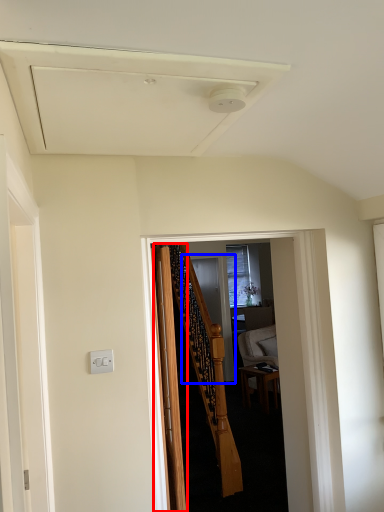
Question: Which object is further to the camera taking this photo, door (highlighted by a red box) or screen door (highlighted by a blue box)?

Choices:
 (A) door
 (B) screen door

Answer: (B)